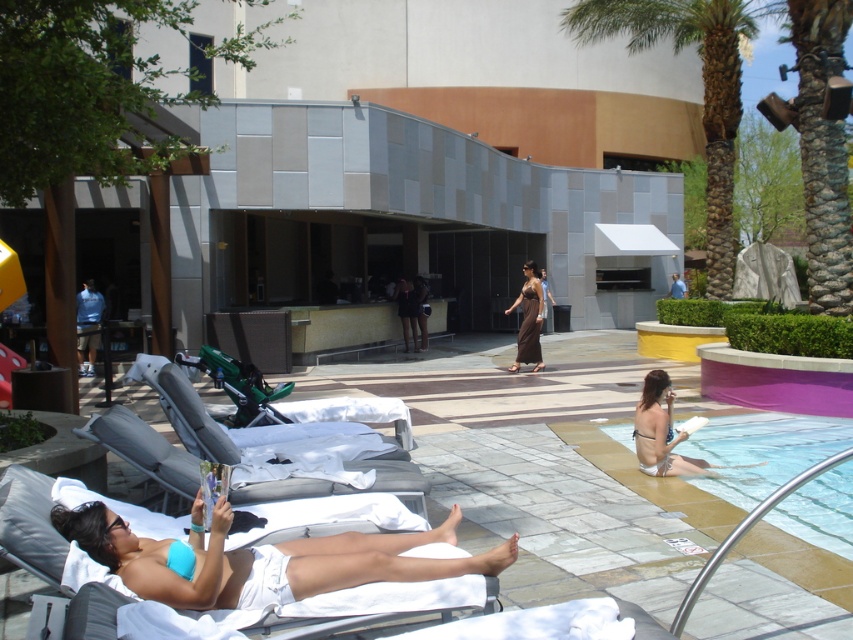
Between point (170, 448) and point (283, 412), which one is positioned in front?

Point (170, 448) is in front.

Consider the image. Between white fabric chair at lower left and green plastic chair at center, which one appears on the left side from the viewer's perspective?

green plastic chair at center

Is point (312, 486) positioned in front of point (407, 436)?

Yes, it is in front of point (407, 436).

This screenshot has height=640, width=853. Identify the location of white fabric chair at lower left. (143, 449).

Is white fabric bikini at lower left above clear blue water at lower right?

Indeed, white fabric bikini at lower left is positioned over clear blue water at lower right.

This screenshot has height=640, width=853. What do you see at coordinates (260, 557) in the screenshot? I see `white fabric bikini at lower left` at bounding box center [260, 557].

Image resolution: width=853 pixels, height=640 pixels. Find the location of `white fabric bikini at lower left`. white fabric bikini at lower left is located at coordinates (260, 557).

Locate an element on the screen. white fabric bikini at lower left is located at coordinates (260, 557).

Does white fabric bikini at lower left have a lesser width compared to shiny brown dress at center?

Incorrect, white fabric bikini at lower left's width is not less than shiny brown dress at center's.

Does point (242, 572) come behind point (544, 291)?

No, (242, 572) is in front of (544, 291).

Find the location of `white fabric bikini at lower left`. white fabric bikini at lower left is located at coordinates (260, 557).